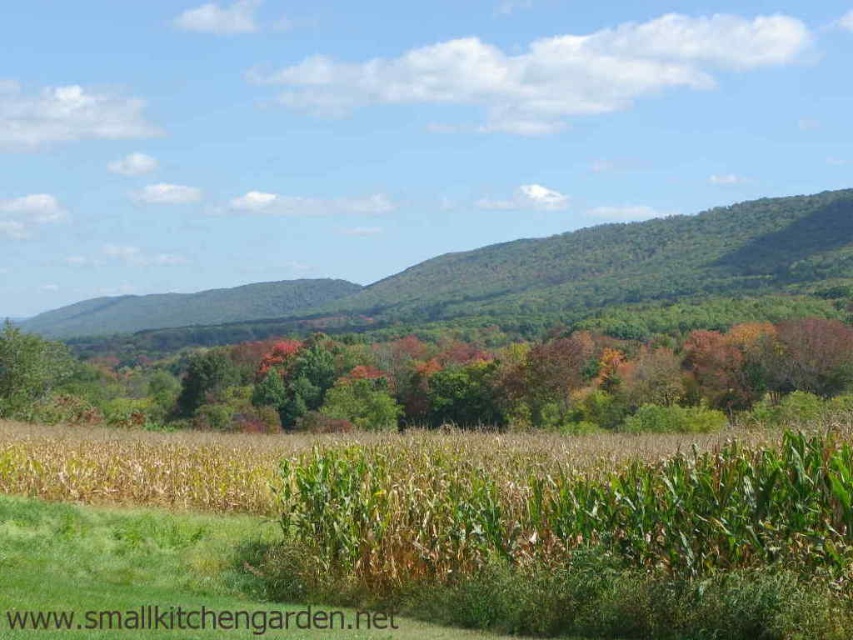
You are standing in the middle of the cornfield and see the green leafy corn at center and the green matte tree at center. Which object is more to the right?

The green leafy corn at center is more to the right side of the green matte tree at center.

You are standing in the middle of the cornfield and see the green matte tree at center and the green leafy forest at center. Which one is closer to you?

The green matte tree at center is closer because it is located below the green leafy forest at center, which places it in a lower, more foreground position.